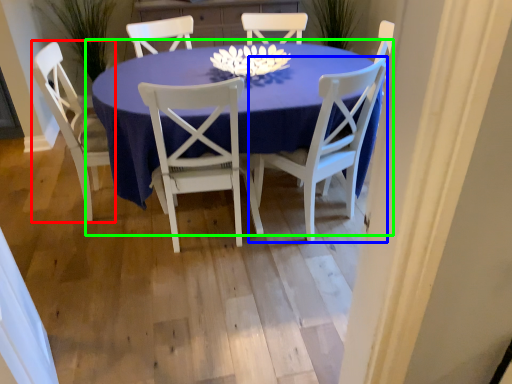
Question: Which object is the closest to the chair (highlighted by a red box)? Choose among these: chair (highlighted by a blue box) or kitchen & dining room table (highlighted by a green box).

Choices:
 (A) chair
 (B) kitchen & dining room table

Answer: (B)